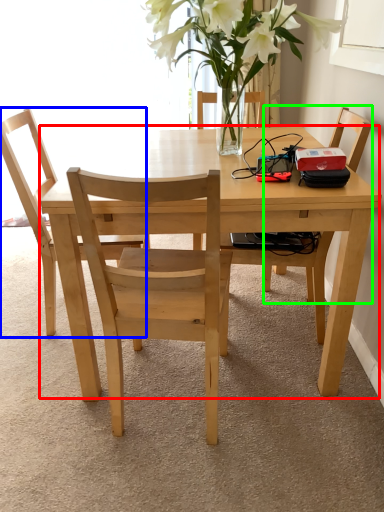
Question: Estimate the real-world distances between objects in this image. Which object is farther from kitchen & dining room table (highlighted by a red box), chair (highlighted by a blue box) or chair (highlighted by a green box)?

Choices:
 (A) chair
 (B) chair

Answer: (B)